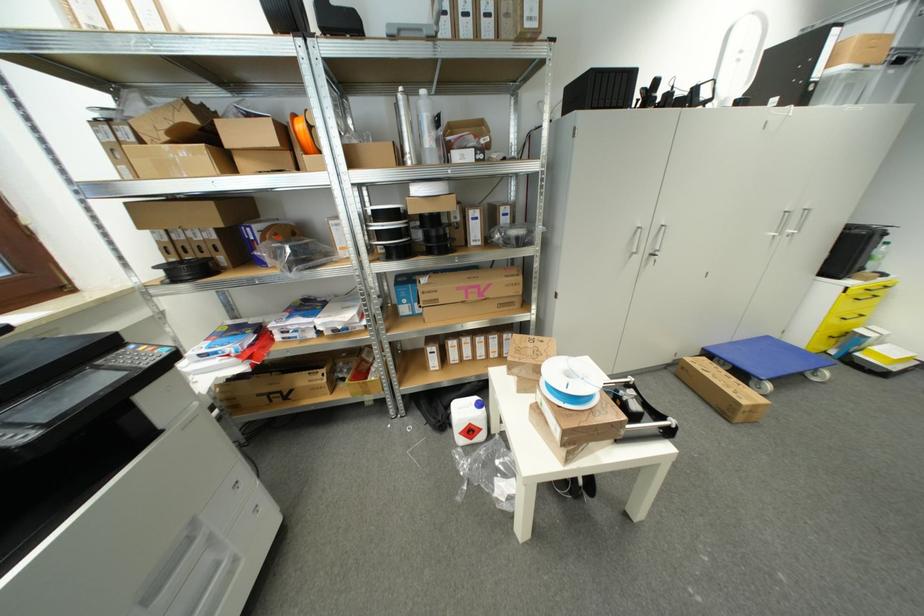
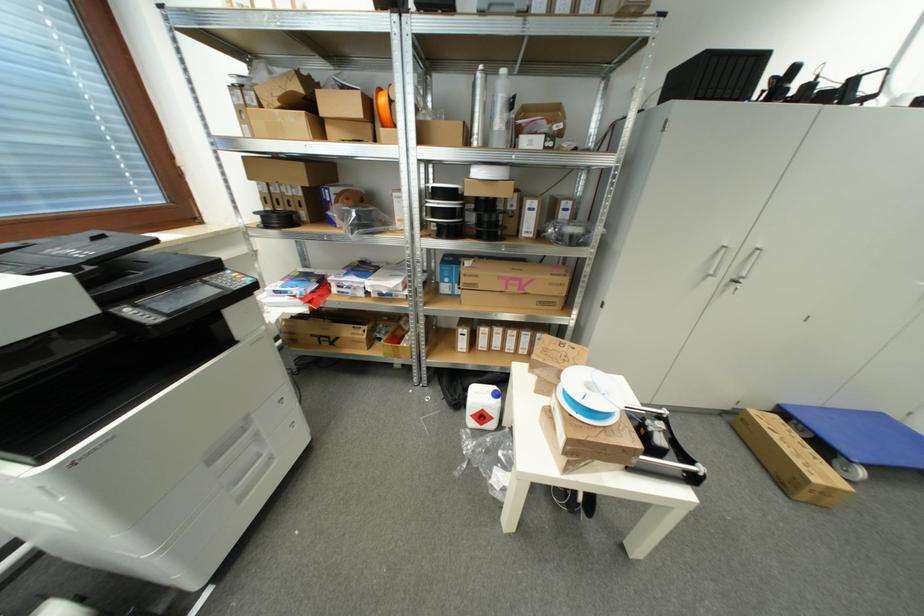
Where in the second image is the point corresponding to [214,543] from the first image?

(261, 438)